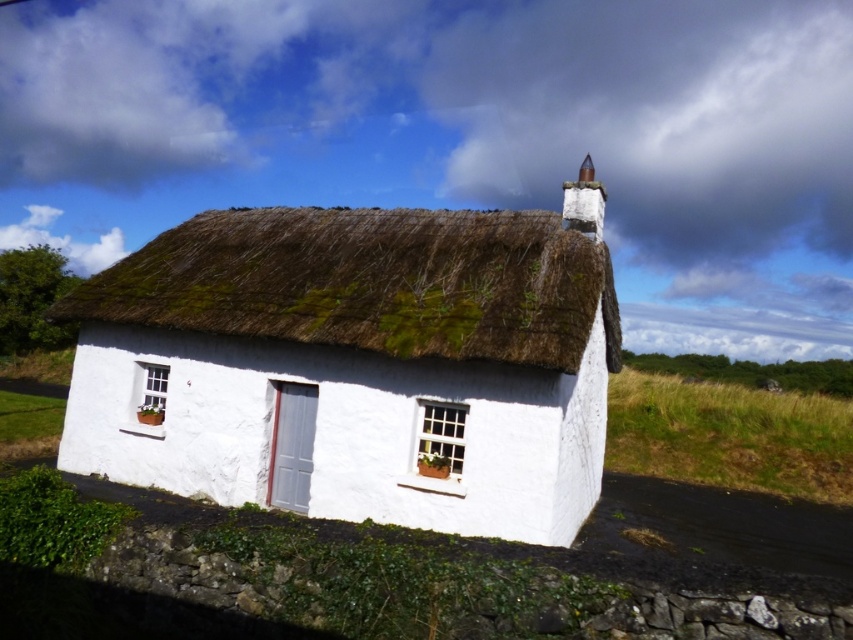
You are standing in front of the cottage and want to place a small garden gnome exactly at the location of point (442, 420) and point (608, 316). Which point is closer to the entrance of the cottage?

Point (442, 420) is in front of point (608, 316), so the gnome placed at point (442, 420) will be closer to the entrance of the cottage.

In the scene shown: You are a painter preparing to paint the cottage. You notice the white thatch roof at center and the green thatch at center. Which one should you paint first if you want to start from the bottom and work upwards?

The white thatch roof at center should be painted first because it is positioned under the green thatch at center, so starting from the bottom makes sense.